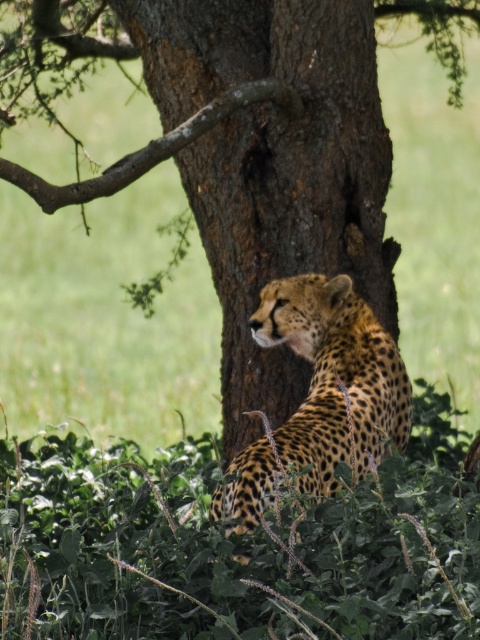
Is brown rough tree trunk at center closer to the viewer compared to spotted fur cheetah at center?

That is False.

Who is lower down, brown rough tree trunk at center or spotted fur cheetah at center?

spotted fur cheetah at center is lower down.

What do you see at coordinates (274, 168) in the screenshot?
I see `brown rough tree trunk at center` at bounding box center [274, 168].

This screenshot has width=480, height=640. Identify the location of brown rough tree trunk at center. (274, 168).